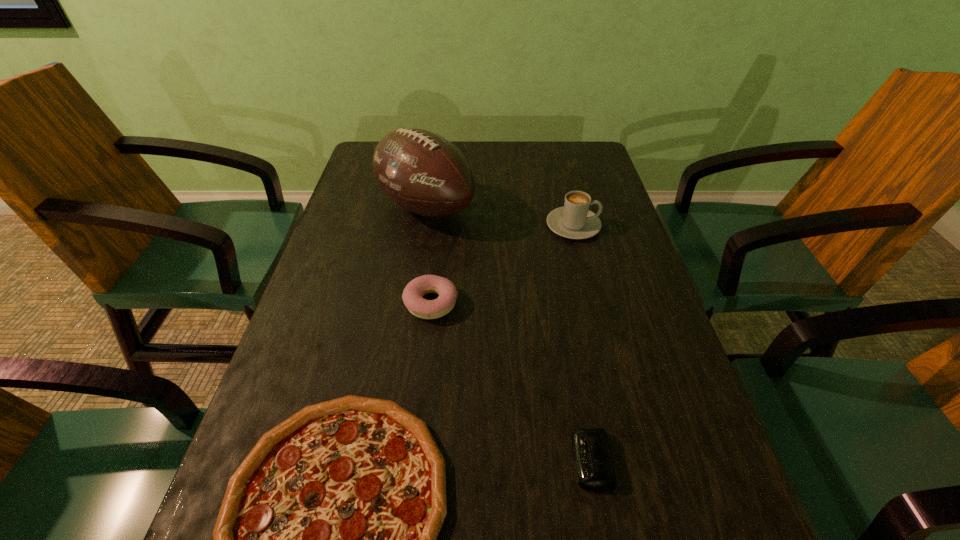
Locate an element on the screen. The image size is (960, 540). the tallest object is located at coordinates (424, 173).

Locate an element on the screen. This screenshot has width=960, height=540. cappuccino is located at coordinates (574, 220).

Identify the location of doughnut. (414, 291).

Find the location of a particular element. the third farthest object is located at coordinates (414, 291).

This screenshot has width=960, height=540. In order to click on alarm clock in this screenshot , I will do pyautogui.click(x=594, y=468).

The height and width of the screenshot is (540, 960). Find the location of `free space located 0.050m on the right of the football (American)`. free space located 0.050m on the right of the football (American) is located at coordinates (493, 208).

This screenshot has height=540, width=960. Identify the location of vacant region located 0.310m on the back of the doughnut. (442, 205).

Where is `free point located on the display of the alarm clock`? The height and width of the screenshot is (540, 960). free point located on the display of the alarm clock is located at coordinates (516, 461).

Image resolution: width=960 pixels, height=540 pixels. I want to click on vacant region located on the display of the alarm clock, so click(x=536, y=461).

This screenshot has width=960, height=540. I want to click on vacant area situated 0.160m on the display of the alarm clock, so click(x=472, y=461).